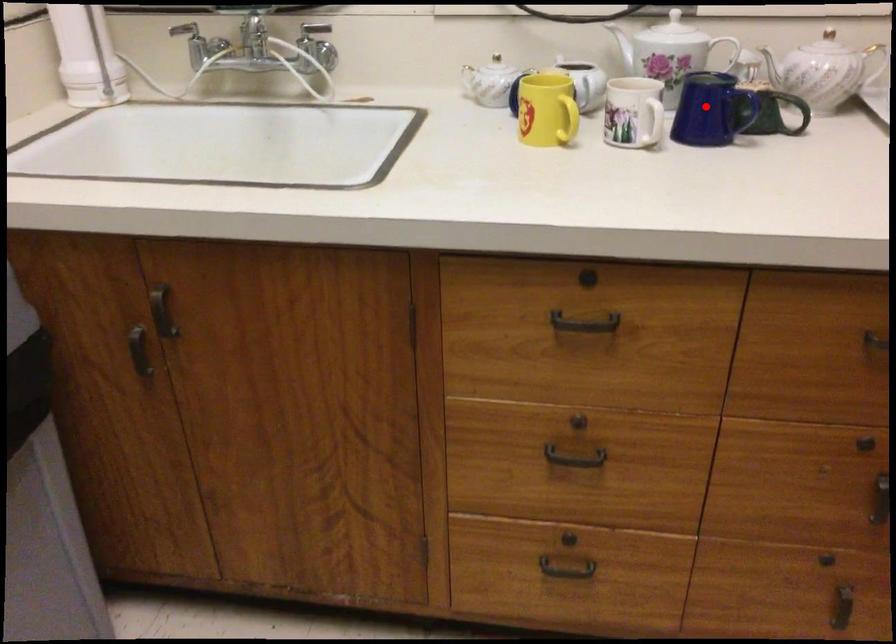
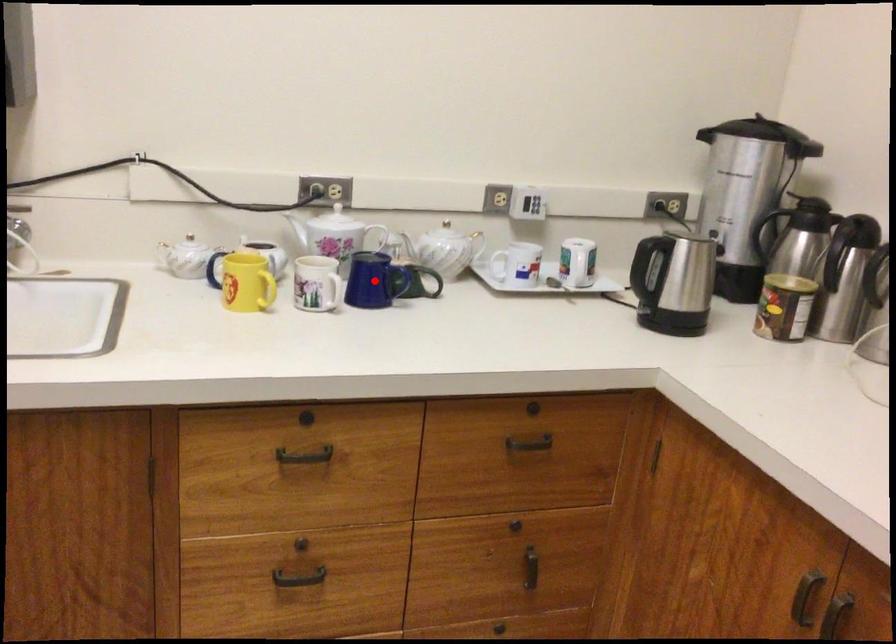
I am providing you with two images of the same scene from different viewpoints. A red point is marked on the first image and another point is marked on the second image. Are the points marked in image1 and image2 representing the same 3D position?

Yes